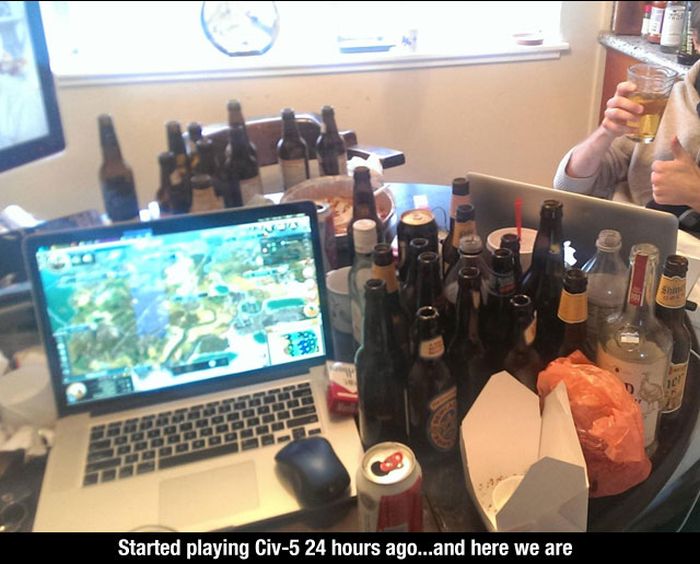
What are the coordinates of `mouse` in the screenshot? It's located at [307, 465].